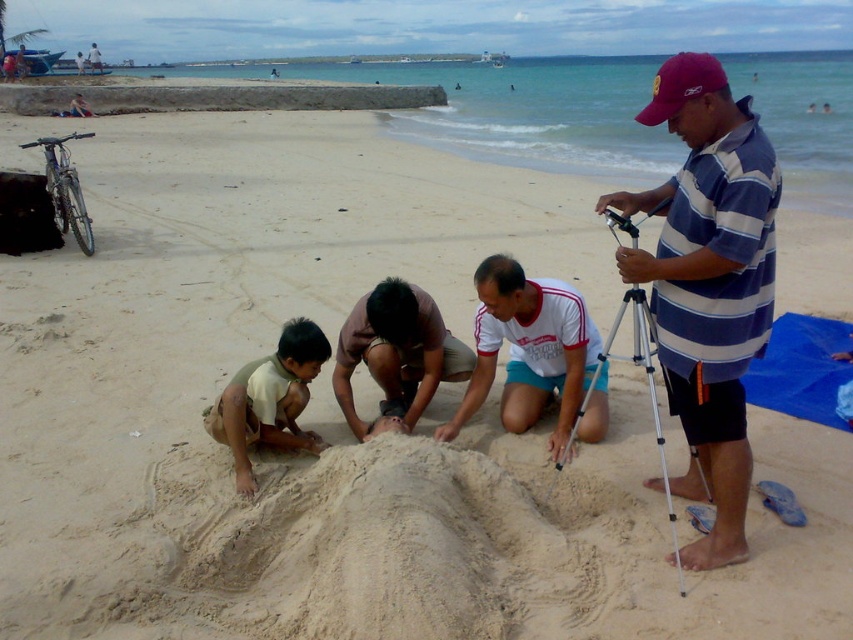
Who is more distant from viewer, (703, 282) or (643, 115)?

Point (643, 115)

Who is positioned more to the left, striped cotton shirt at center or red fabric cap at upper center?

Positioned to the left is striped cotton shirt at center.

In order to click on striped cotton shirt at center in this screenshot , I will do `click(708, 282)`.

Can you confirm if light brown sand at lower left is taller than silver metallic tripod at right?

Incorrect, light brown sand at lower left's height is not larger of silver metallic tripod at right's.

Can you confirm if light brown sand at lower left is positioned to the left of silver metallic tripod at right?

Yes, light brown sand at lower left is to the left of silver metallic tripod at right.

Who is more forward, (308, 330) or (653, 349)?

Positioned in front is point (653, 349).

Where is `light brown sand at lower left`? This screenshot has width=853, height=640. light brown sand at lower left is located at coordinates (270, 400).

Between silver metallic tripod at right and red fabric cap at upper center, which one appears on the right side from the viewer's perspective?

Positioned to the right is red fabric cap at upper center.

Is point (660, 451) closer to camera compared to point (671, 116)?

No, (660, 451) is further to viewer.

The width and height of the screenshot is (853, 640). I want to click on silver metallic tripod at right, so click(647, 387).